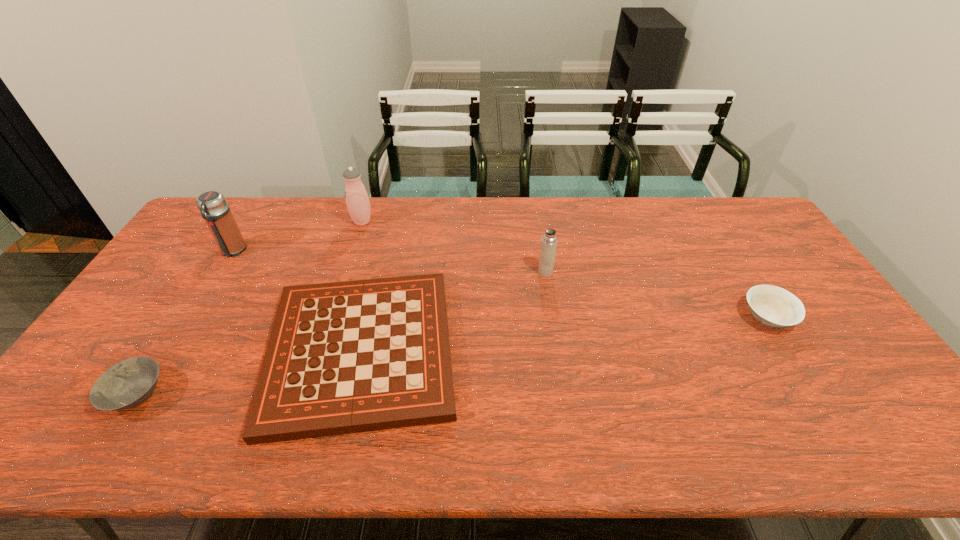
At what (x,y) coordinates should I click in order to perform the action: click on bowl that is at the left edge. Please return your answer as a coordinate pair (x, y). The image size is (960, 540). Looking at the image, I should click on (127, 384).

Where is `object located at the right edge`? The width and height of the screenshot is (960, 540). object located at the right edge is located at coordinates (773, 306).

Where is `object that is at the near left corner`? object that is at the near left corner is located at coordinates (127, 384).

At what (x,y) coordinates should I click in order to perform the action: click on free space at the far edge of the desktop. Please return your answer as a coordinate pair (x, y). Looking at the image, I should click on (515, 210).

In order to click on vacant space at the near edge of the desktop in this screenshot , I will do `click(849, 453)`.

At what (x,y) coordinates should I click in order to perform the action: click on free space at the right edge. Please return your answer as a coordinate pair (x, y). Looking at the image, I should click on (749, 263).

Identify the location of vacant space at the near left corner. (97, 421).

At what (x,y) coordinates should I click in order to perform the action: click on blank space at the far right corner. Please return your answer as a coordinate pair (x, y). Looking at the image, I should click on (735, 200).

Locate an element on the screen. free space between the left bowl and the gameboard is located at coordinates (249, 372).

The width and height of the screenshot is (960, 540). I want to click on free spot between the gameboard and the shortest thermos bottle, so click(453, 312).